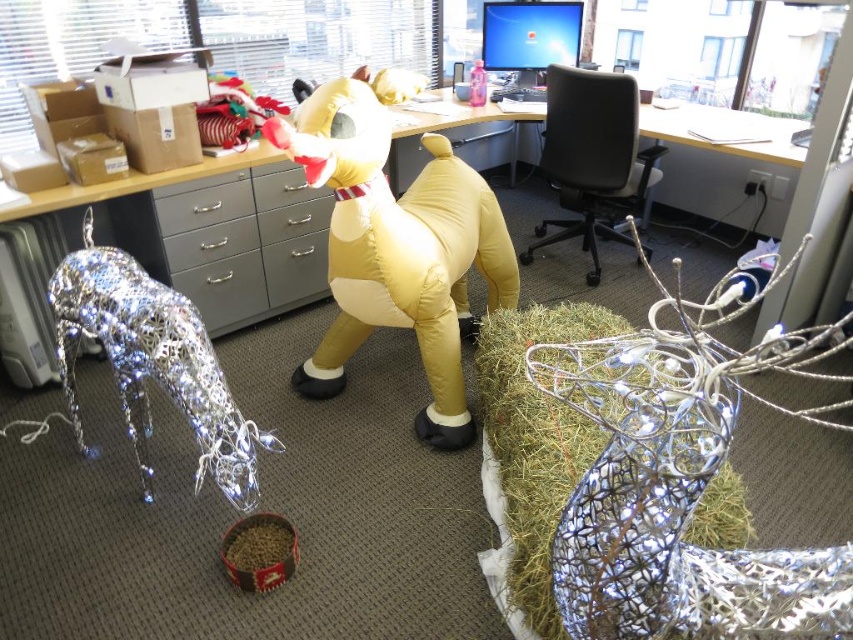
Which of these two, yellow inflatable dog at center or metallic wire reindeer at left, stands taller?

With more height is yellow inflatable dog at center.

Where is `yellow inflatable dog at center`? The width and height of the screenshot is (853, 640). yellow inflatable dog at center is located at coordinates (396, 243).

The image size is (853, 640). Describe the element at coordinates (396, 243) in the screenshot. I see `yellow inflatable dog at center` at that location.

Locate an element on the screen. The width and height of the screenshot is (853, 640). yellow inflatable dog at center is located at coordinates (396, 243).

Does yellow inflatable dog at center appear over silvery metallic hay at lower right?

Correct, yellow inflatable dog at center is located above silvery metallic hay at lower right.

Can you confirm if yellow inflatable dog at center is wider than silvery metallic hay at lower right?

Yes.

Where is `yellow inflatable dog at center`? The width and height of the screenshot is (853, 640). yellow inflatable dog at center is located at coordinates (396, 243).

Does yellow inflatable dog at center appear under matte gray computer desk at center?

Indeed, yellow inflatable dog at center is positioned under matte gray computer desk at center.

Who is more forward, (463, 413) or (27, 196)?

Point (27, 196)

Image resolution: width=853 pixels, height=640 pixels. Identify the location of yellow inflatable dog at center. (396, 243).